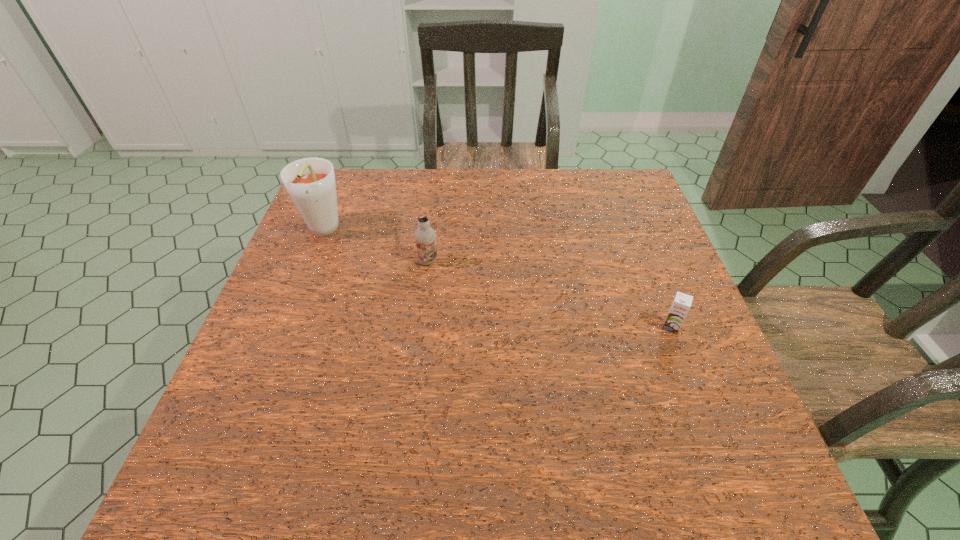
Where is `the tallest object`? the tallest object is located at coordinates tap(310, 182).

Image resolution: width=960 pixels, height=540 pixels. I want to click on root beer, so click(x=310, y=182).

Find the location of a particular element. the second object from left to right is located at coordinates (425, 236).

The height and width of the screenshot is (540, 960). Find the location of `the taller chocolate milk`. the taller chocolate milk is located at coordinates (425, 236).

You are a GUI agent. You are given a task and a screenshot of the screen. Output one action in this format:
    pyautogui.click(x=<x>, y=<y>)
    Task: Click on the shortest object
    The width and height of the screenshot is (960, 540).
    Given the screenshot: What is the action you would take?
    pyautogui.click(x=682, y=302)

I want to click on the right chocolate milk, so click(682, 302).

Where is `vacant space located on the drink side of the leftmost object`? vacant space located on the drink side of the leftmost object is located at coordinates (270, 364).

I want to click on vacant space positioned on the back of the second nearest object, so click(437, 187).

I want to click on blank space located 0.120m on the left of the right chocolate milk, so click(606, 327).

Locate an element on the screen. object that is at the far edge is located at coordinates pyautogui.click(x=310, y=182).